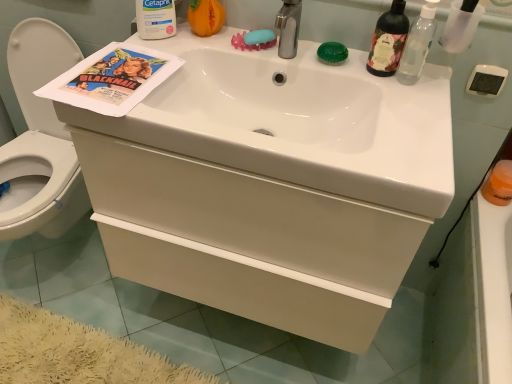
Question: Relative to transparent plastic bottle at upper right, the 1th bottle from the right, is white matte drawer at center in front or behind?

Choices:
 (A) behind
 (B) front

Answer: (B)

Question: In terms of width, does white matte drawer at center look wider or thinner when compared to transparent plastic bottle at upper right, which is counted as the third bottle, starting from the left?

Choices:
 (A) wide
 (B) thin

Answer: (A)

Question: Considering the real-world distances, which object is farthest from the orange plastic cup at right?

Choices:
 (A) matte paper poster at upper left
 (B) white glossy sink at center
 (C) transparent plastic bottle at upper right, which is counted as the third bottle, starting from the left
 (D) white matte drawer at center
 (E) white glossy toilet at left

Answer: (E)

Question: Estimate the real-world distances between objects in this image. Which object is closer to the matte paper poster at upper left?

Choices:
 (A) green translucent soap at upper center, which is counted as the 1th soap, starting from the right
 (B) white matte lotion at upper center, which is counted as the 3th bottle, starting from the right
 (C) blue rubber soap at upper center, which ranks as the 2th soap in right-to-left order
 (D) orange plastic cup at right
 (E) transparent plastic bottle at upper right, which is counted as the third bottle, starting from the left

Answer: (B)